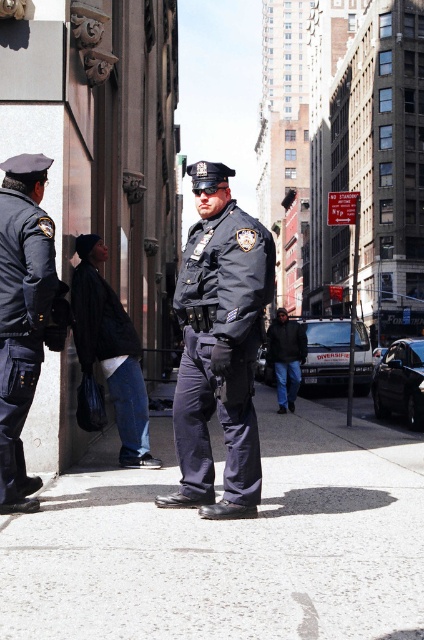
You are a pedestrian on the street and see the dark blue uniform at center and the matte black uniform at left. Which officer is closer to the left side of the image?

The matte black uniform at left is closer to the left side of the image because the dark blue uniform at center is to its right.

You are a photographer standing in the middle of the street. You want to take a photo of both the dark blue uniform at center and the matte black uniform at left. Which uniform will appear larger in the photo?

The matte black uniform at left will appear larger in the photo because it is taller than the dark blue uniform at center.

You are a delivery person trying to navigate through the street scene. You need to place a package on the gray concrete sidewalk at center. However, there is a matte black uniform at left in your way. Based on their positions, which object is on the left side from your perspective?

The matte black uniform at left is on the left side from your perspective because the gray concrete sidewalk at center is positioned on the right side of matte black uniform at left.